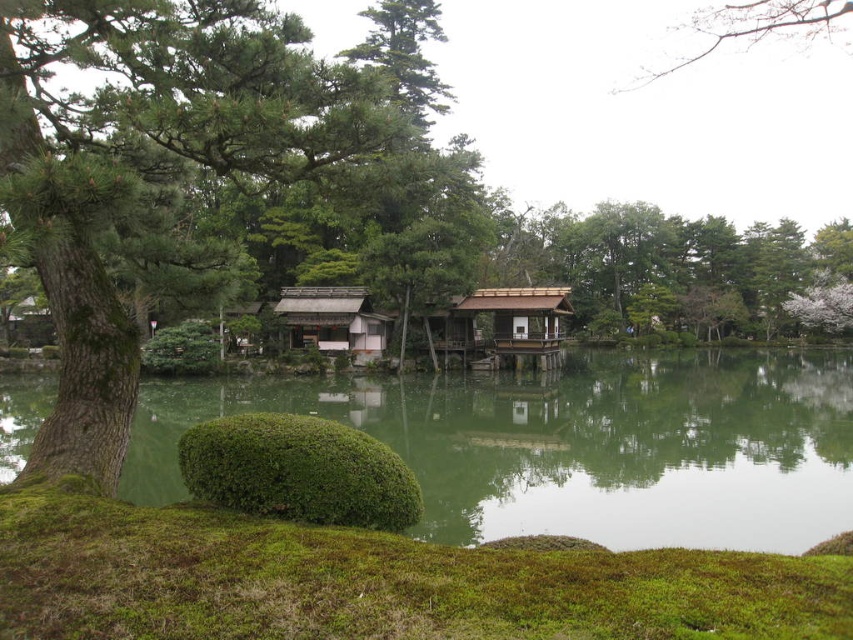
Does bare branches at upper right appear under brown wooden hut at center?

No.

Is bare branches at upper right positioned before brown wooden hut at center?

Yes, bare branches at upper right is closer to the viewer.

Is point (618, 88) behind point (526, 308)?

Yes.

The height and width of the screenshot is (640, 853). I want to click on bare branches at upper right, so pyautogui.click(x=756, y=28).

From the picture: Is bare branches at upper right below wooden shingled hut at center?

No.

Which is in front, point (786, 3) or point (345, 324)?

Point (786, 3) is in front.

Locate an element on the screen. bare branches at upper right is located at coordinates (756, 28).

Is green reflective water at center taller than wooden shingled hut at center?

No, green reflective water at center is not taller than wooden shingled hut at center.

Is green reflective water at center positioned at the back of wooden shingled hut at center?

No, it is in front of wooden shingled hut at center.

Is point (187, 419) closer to viewer compared to point (296, 301)?

Yes, it is.

You are a GUI agent. You are given a task and a screenshot of the screen. Output one action in this format:
    pyautogui.click(x=<x>, y=<y>)
    Task: Click on the green reflective water at center
    The width and height of the screenshot is (853, 640).
    Given the screenshot: What is the action you would take?
    pyautogui.click(x=573, y=444)